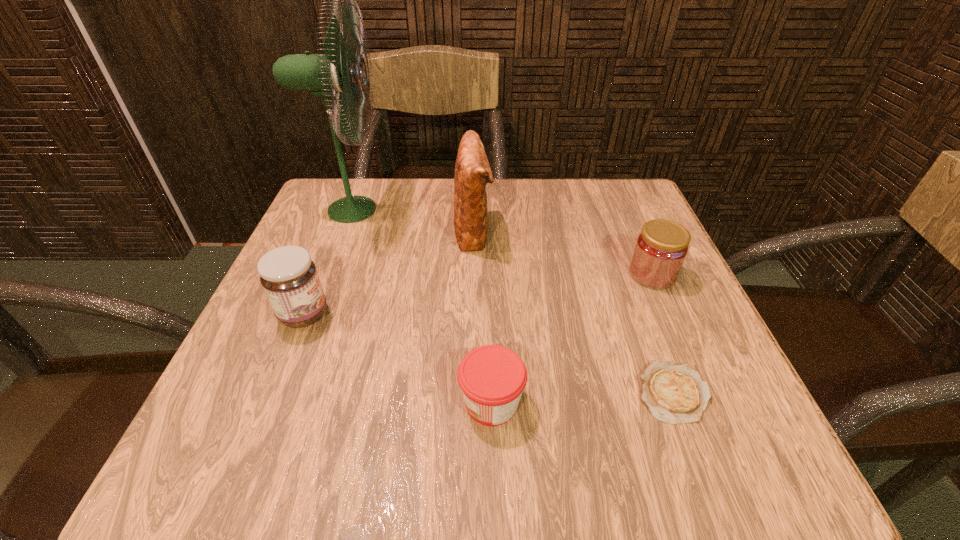
This screenshot has width=960, height=540. I want to click on quiche present at the near edge, so click(673, 393).

Where is `fan located in the left edge section of the desktop`? fan located in the left edge section of the desktop is located at coordinates (337, 73).

At what (x,y) coordinates should I click in order to perform the action: click on jam that is at the left edge. Please return your answer as a coordinate pair (x, y). This screenshot has width=960, height=540. Looking at the image, I should click on (289, 277).

At what (x,y) coordinates should I click in order to perform the action: click on jam at the right edge. Please return your answer as a coordinate pair (x, y). This screenshot has height=540, width=960. Looking at the image, I should click on (661, 248).

This screenshot has height=540, width=960. Find the location of `quiche present at the right edge`. quiche present at the right edge is located at coordinates (673, 393).

This screenshot has width=960, height=540. What are the coordinates of `object that is positioned at the far left corner` in the screenshot? It's located at (337, 73).

This screenshot has width=960, height=540. Find the location of `object at the near right corner`. object at the near right corner is located at coordinates (673, 393).

Where is `vacant space at the far edge of the desktop`? The image size is (960, 540). vacant space at the far edge of the desktop is located at coordinates (545, 224).

Where is `free space at the near edge`? This screenshot has width=960, height=540. free space at the near edge is located at coordinates (449, 468).

Find the location of `blank space at the left edge`. blank space at the left edge is located at coordinates (311, 356).